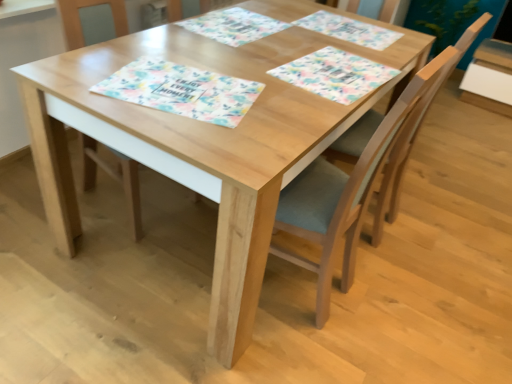
Identify the location of vacant space in between floral paper placemat at upper center, marked as the 1th place mat in a back-to-front arrangement, and floral paper placemat at center, which is the 4th place mat in back-to-front order. (280, 56).